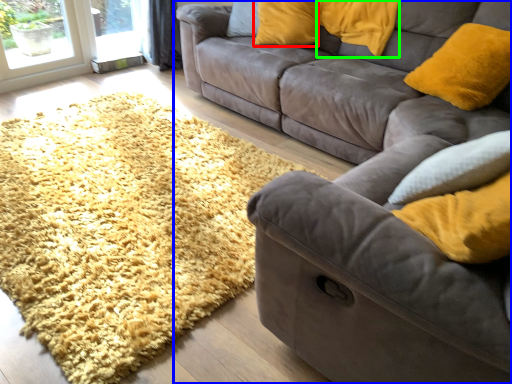
Question: Which object is the closest to the pillow (highlighted by a red box)? Choose among these: studio couch (highlighted by a blue box) or pillow (highlighted by a green box).

Choices:
 (A) studio couch
 (B) pillow

Answer: (B)